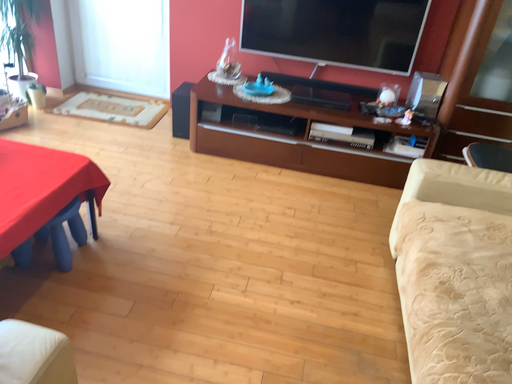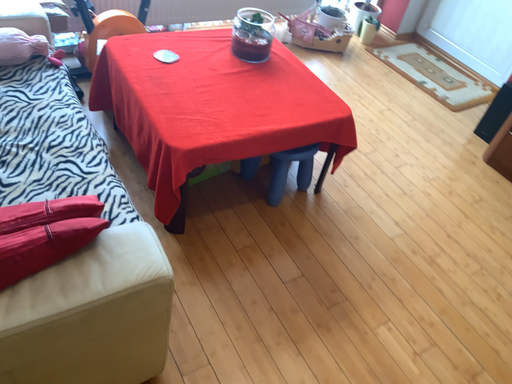
Question: How did the camera likely rotate when shooting the video?

Choices:
 (A) rotated left
 (B) rotated right

Answer: (A)